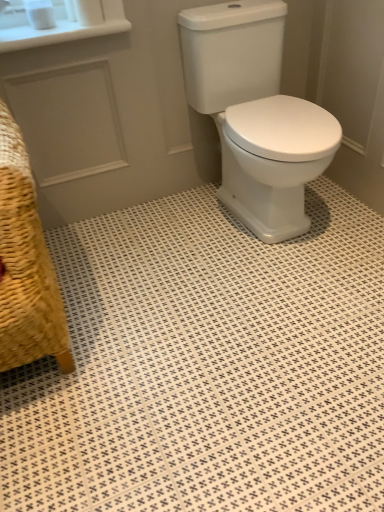
Where is `vacant space in front of white glossy porcelain at center`? The height and width of the screenshot is (512, 384). vacant space in front of white glossy porcelain at center is located at coordinates (273, 290).